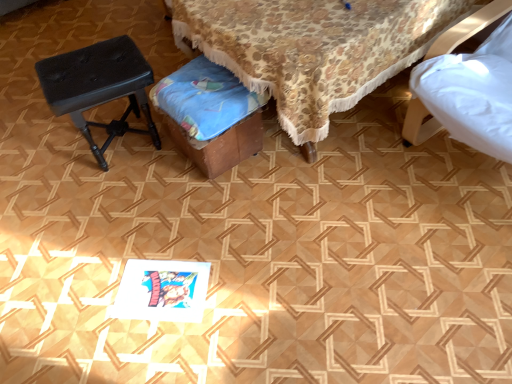
At what (x,y) coordinates should I click in order to perform the action: click on free space in front of wooden stool at center. Please return your answer as a coordinate pair (x, y). The image size is (512, 384). Looking at the image, I should click on (312, 268).